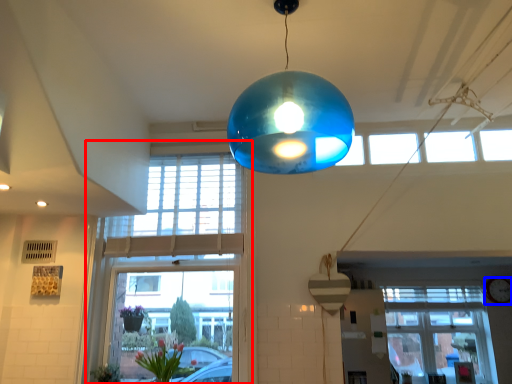
Question: Which object appears closest to the camera in this image, window (highlighted by a red box) or clock (highlighted by a blue box)?

Choices:
 (A) window
 (B) clock

Answer: (A)